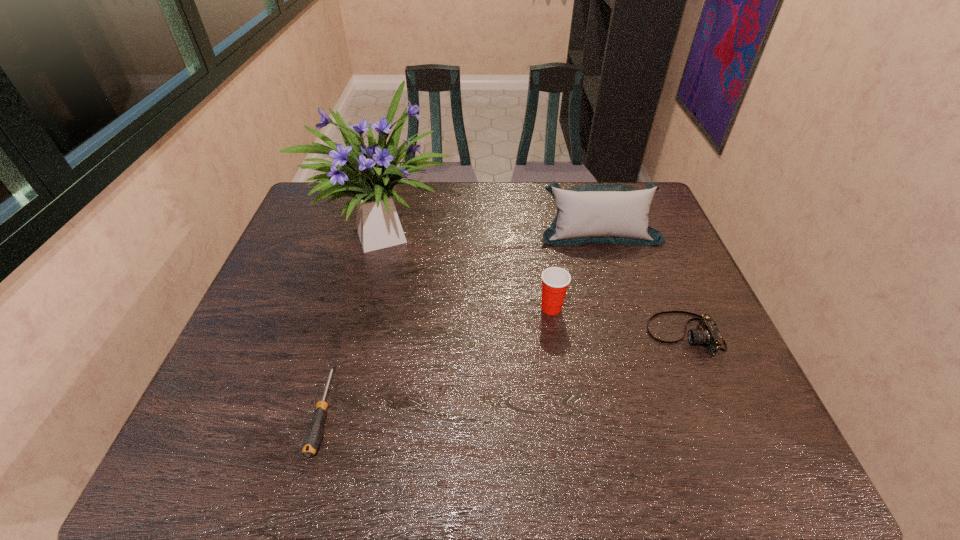
Where is `object located in the far right corner section of the desktop`? object located in the far right corner section of the desktop is located at coordinates (591, 213).

In the image, there is a desktop. In order to click on free space at the far edge in this screenshot , I will do `click(444, 199)`.

Locate an element on the screen. The image size is (960, 540). free spot at the near edge of the desktop is located at coordinates (428, 434).

At what (x,y) coordinates should I click in order to perform the action: click on vacant space at the left edge of the desktop. Please return your answer as a coordinate pair (x, y). Looking at the image, I should click on (320, 257).

Find the location of a particular element. The height and width of the screenshot is (540, 960). vacant point at the right edge is located at coordinates (685, 267).

This screenshot has height=540, width=960. What are the coordinates of `vacant region between the second shortest object and the flower arrangement` in the screenshot? It's located at (536, 282).

Find the location of a particular element. free space between the second shortest object and the tallest object is located at coordinates (536, 282).

You are a GUI agent. You are given a task and a screenshot of the screen. Output one action in this format:
    pyautogui.click(x=<x>, y=<y>)
    Task: Click on the free space between the nearest object and the fourth tallest object
    
    Given the screenshot: What is the action you would take?
    pyautogui.click(x=504, y=372)

This screenshot has width=960, height=540. What are the coordinates of `vacant area between the tallest object and the second shortest object` in the screenshot? It's located at (536, 282).

At what (x,y) coordinates should I click in order to perform the action: click on vacant area that lies between the Dixie cup and the second shortest object. Please return your answer as a coordinate pair (x, y). The image size is (960, 540). Looking at the image, I should click on (617, 321).